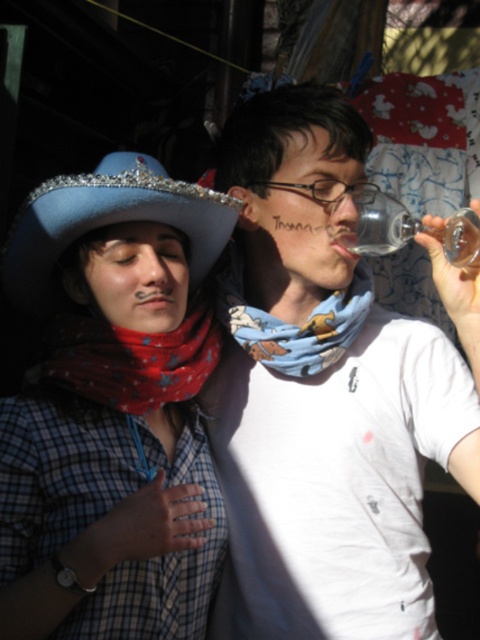
Is blue rhinestone cowboy hat at upper left to the right of blue bandana at center from the viewer's perspective?

Incorrect, blue rhinestone cowboy hat at upper left is not on the right side of blue bandana at center.

Is point (94, 176) positioned behind point (271, 289)?

No, it is in front of (271, 289).

You are a GUI agent. You are given a task and a screenshot of the screen. Output one action in this format:
    pyautogui.click(x=<x>, y=<y>)
    Task: Click on the blue rhinestone cowboy hat at upper left
    The image size is (480, 640).
    Given the screenshot: What is the action you would take?
    pyautogui.click(x=108, y=221)

Who is more forward, (358, 269) or (385, 221)?

Positioned in front is point (385, 221).

Does point (348, 289) come behind point (368, 237)?

Yes, it is behind point (368, 237).

Is point (349, 321) closer to viewer compared to point (387, 230)?

No.

Image resolution: width=480 pixels, height=640 pixels. Find the location of `printed cotton scarf at center`. printed cotton scarf at center is located at coordinates (295, 324).

Consider the image. Does white cotton shirt at center come in front of blue bandana at center?

Yes, white cotton shirt at center is closer to the viewer.

The width and height of the screenshot is (480, 640). Find the location of `white cotton shirt at center`. white cotton shirt at center is located at coordinates (322, 394).

The height and width of the screenshot is (640, 480). Describe the element at coordinates (322, 394) in the screenshot. I see `white cotton shirt at center` at that location.

I want to click on white cotton shirt at center, so click(x=322, y=394).